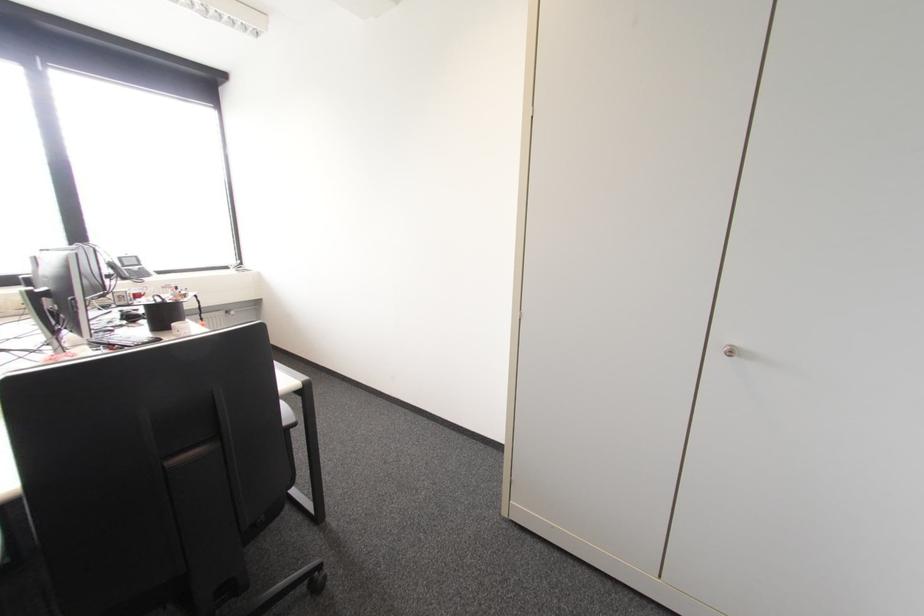
Find the location of a particular element. This screenshot has width=924, height=616. silver cabinet knob is located at coordinates click(x=730, y=350).